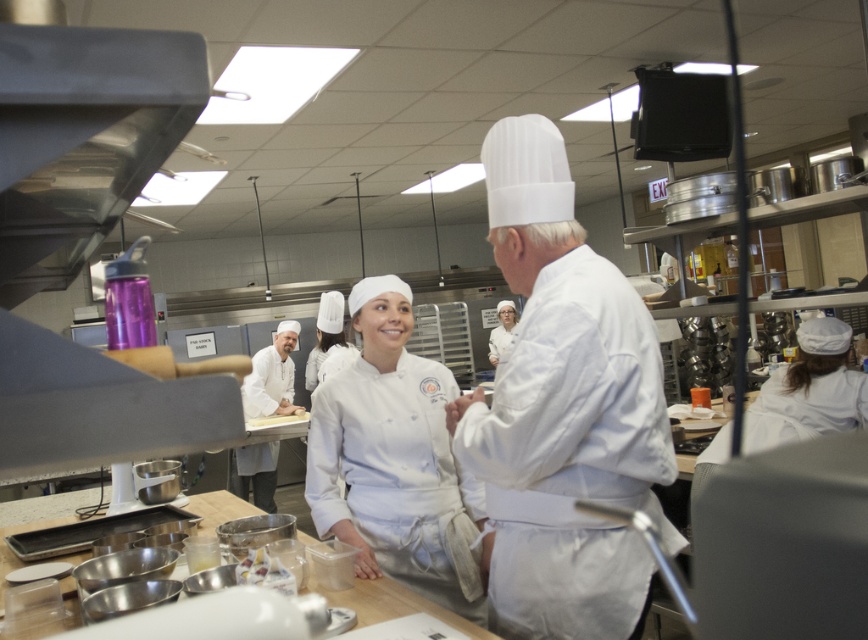
You are standing in the kitchen and need to reach both the point at coordinates point (541, 188) and the point at coordinates point (391, 394). Which coordinate point will you reach first?

You will reach point (541, 188) first because it is closer to you than point (391, 394).